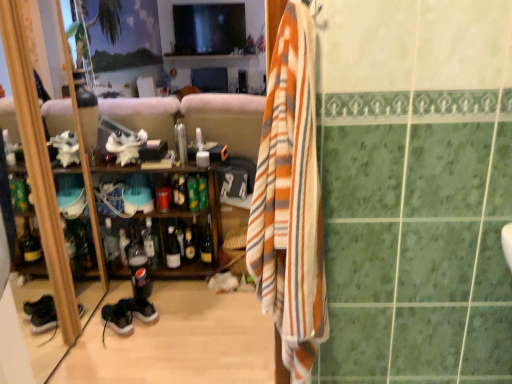
Question: In which direction should I rotate to look at translucent plastic bottle at center, which appears as the 2th bottle when viewed from the left?

Choices:
 (A) right
 (B) left

Answer: (B)

Question: Is the surface of wooden cabinet at left in direct contact with green glass bottle at center, which appears as the 2th bottle when viewed from the right?

Choices:
 (A) no
 (B) yes

Answer: (A)

Question: Is wooden cabinet at left to the right of green glass bottle at center, positioned as the eighth bottle in left-to-right order, from the viewer's perspective?

Choices:
 (A) no
 (B) yes

Answer: (A)

Question: Does wooden cabinet at left come behind green glass bottle at center, which appears as the 2th bottle when viewed from the right?

Choices:
 (A) no
 (B) yes

Answer: (A)

Question: Is wooden cabinet at left wider than green glass bottle at center, which appears as the 2th bottle when viewed from the right?

Choices:
 (A) no
 (B) yes

Answer: (B)

Question: Is wooden cabinet at left at the left side of green glass bottle at center, positioned as the eighth bottle in left-to-right order?

Choices:
 (A) no
 (B) yes

Answer: (B)

Question: Does wooden cabinet at left have a larger size compared to green glass bottle at center, positioned as the eighth bottle in left-to-right order?

Choices:
 (A) no
 (B) yes

Answer: (B)

Question: From the image's perspective, would you say wooden cabinet at left is positioned over transparent plastic faucet at center?

Choices:
 (A) yes
 (B) no

Answer: (B)

Question: Are wooden cabinet at left and transparent plastic faucet at center making contact?

Choices:
 (A) yes
 (B) no

Answer: (B)

Question: Is wooden cabinet at left looking in the opposite direction of transparent plastic faucet at center?

Choices:
 (A) no
 (B) yes

Answer: (A)

Question: Does wooden cabinet at left have a smaller size compared to transparent plastic faucet at center?

Choices:
 (A) no
 (B) yes

Answer: (A)

Question: Would you consider wooden cabinet at left to be distant from transparent plastic faucet at center?

Choices:
 (A) yes
 (B) no

Answer: (B)

Question: Considering the relative positions of wooden cabinet at left and transparent plastic faucet at center in the image provided, is wooden cabinet at left to the left of transparent plastic faucet at center from the viewer's perspective?

Choices:
 (A) yes
 (B) no

Answer: (A)

Question: Does suede black shoe at lower left have a greater width compared to shiny gold bottle at center, the 1th bottle from the right?

Choices:
 (A) no
 (B) yes

Answer: (B)